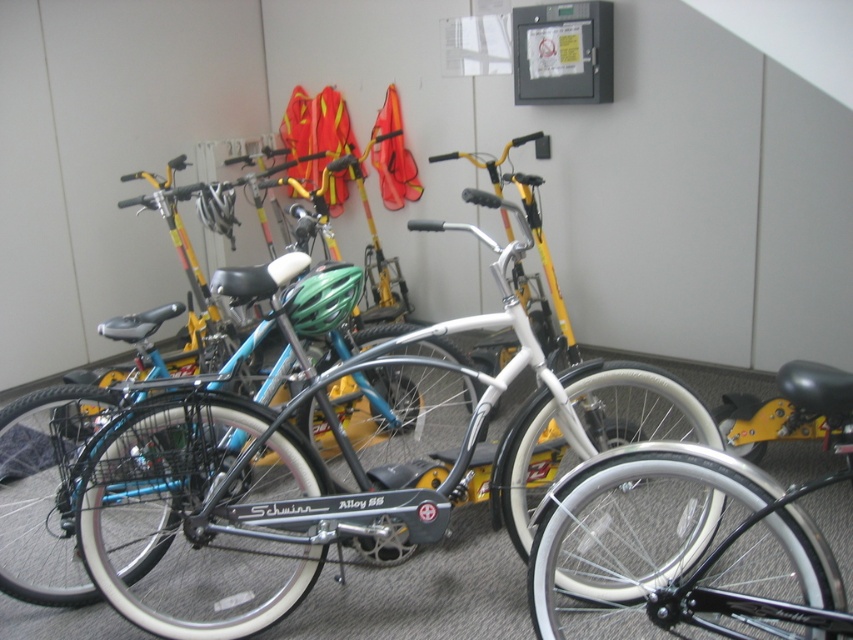
Is shiny silver bicycle at center taller than white rubber bicycle at center?

Yes.

Who is shorter, shiny silver bicycle at center or white rubber bicycle at center?

white rubber bicycle at center is shorter.

Is point (235, 451) positioned behind point (724, 576)?

Yes, it is.

The width and height of the screenshot is (853, 640). I want to click on shiny silver bicycle at center, so click(323, 461).